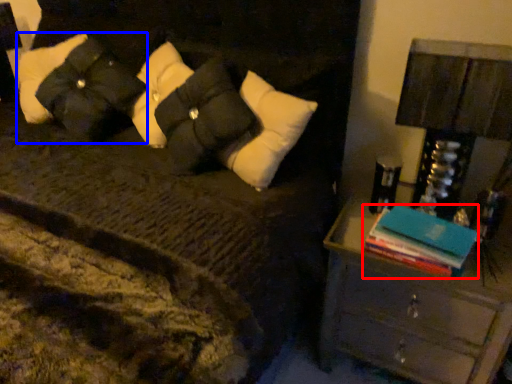
Question: Which of the following is the closest to the observer, book (highlighted by a red box) or pillow (highlighted by a blue box)?

Choices:
 (A) book
 (B) pillow

Answer: (A)